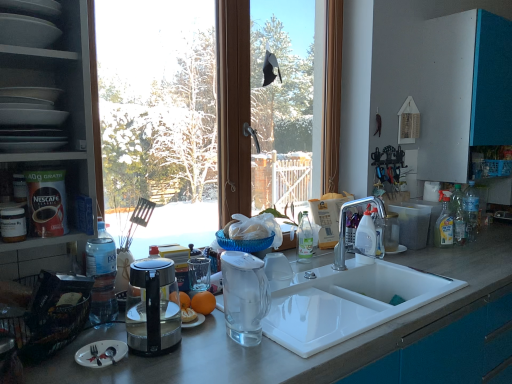
The image size is (512, 384). What are the coordinates of `vacant region to the left of silver metallic faucet at sink right` in the screenshot? It's located at (312, 272).